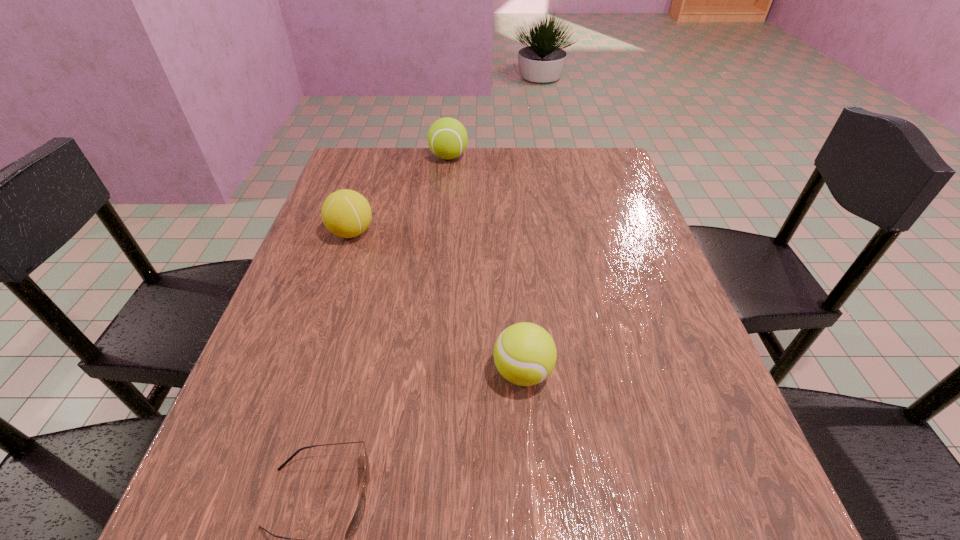
You are a GUI agent. You are given a task and a screenshot of the screen. Output one action in this format:
    pyautogui.click(x=<x>, y=<y>)
    Task: Click on the second object from right to left
    Image resolution: width=960 pixels, height=540 pixels.
    Given the screenshot: What is the action you would take?
    pyautogui.click(x=447, y=138)

Locate an element on the screen. the farthest tennis ball is located at coordinates (447, 138).

This screenshot has height=540, width=960. Find the location of `the third nearest object`. the third nearest object is located at coordinates (346, 213).

Locate an element on the screen. Image resolution: width=960 pixels, height=540 pixels. the leftmost tennis ball is located at coordinates (346, 213).

The height and width of the screenshot is (540, 960). What are the coordinates of `the third farthest object` in the screenshot? It's located at pyautogui.click(x=525, y=354).

Identify the location of the nearest tennis ball. Image resolution: width=960 pixels, height=540 pixels. (525, 354).

You are a GUI agent. You are given a task and a screenshot of the screen. Output one action in this format:
    pyautogui.click(x=<x>, y=<y>)
    Task: Click on the free space located on the left of the third object from left to right
    This screenshot has width=960, height=540.
    Given the screenshot: What is the action you would take?
    pyautogui.click(x=372, y=157)

I want to click on free space located on the front of the second farthest object, so click(x=317, y=337).

Find the location of `vacant area located 0.070m on the left of the nearest tennis ball`. vacant area located 0.070m on the left of the nearest tennis ball is located at coordinates (453, 372).

Where is `object at the far edge`? object at the far edge is located at coordinates (447, 138).